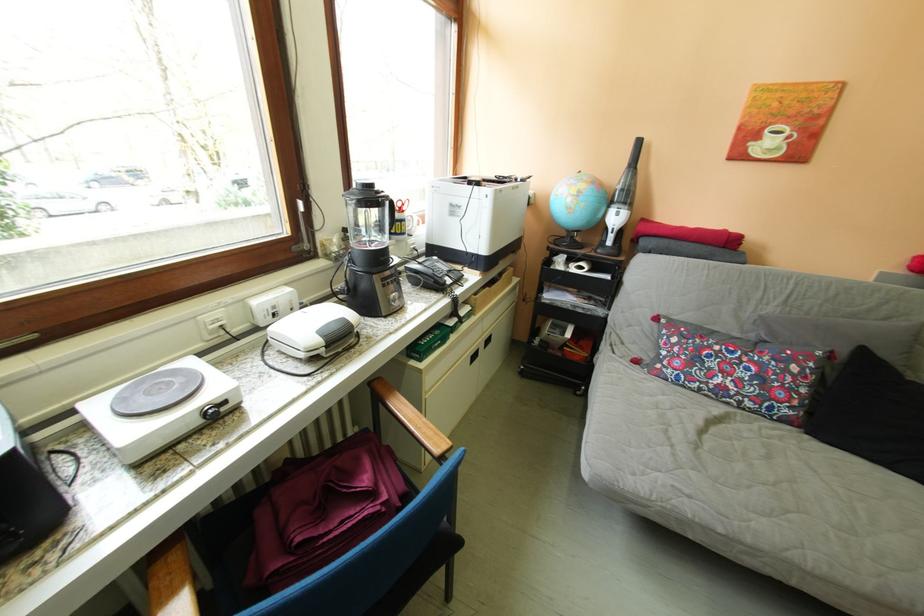
Describe the element at coordinates (213, 411) in the screenshot. I see `the hot plate knob` at that location.